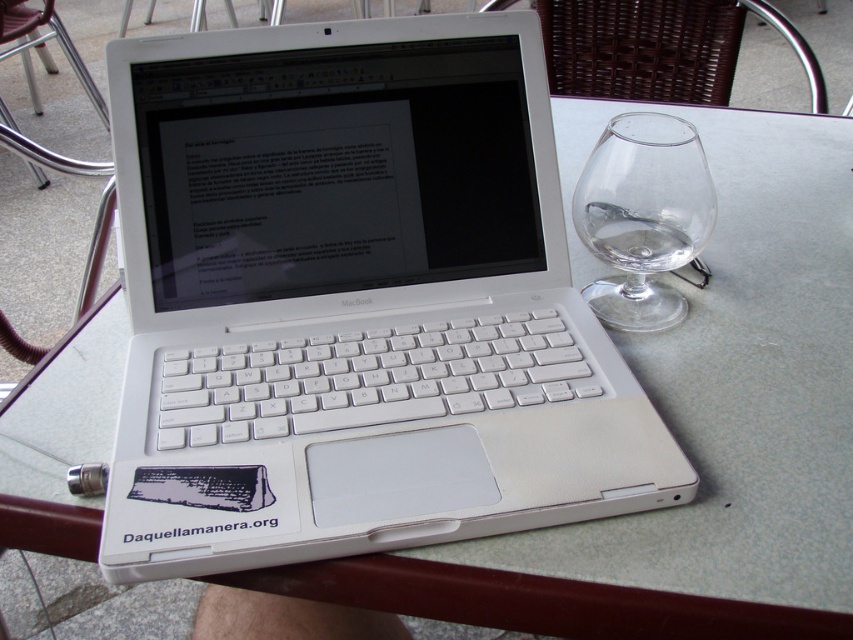
Between white plastic laptop at center and transparent glass wine glass at right, which one has less height?

With less height is transparent glass wine glass at right.

Does white plastic laptop at center have a greater width compared to transparent glass wine glass at right?

Yes.

Is point (451, 138) closer to camera compared to point (630, 316)?

Yes, it is in front of point (630, 316).

Locate an element on the screen. This screenshot has height=640, width=853. white plastic laptop at center is located at coordinates (355, 301).